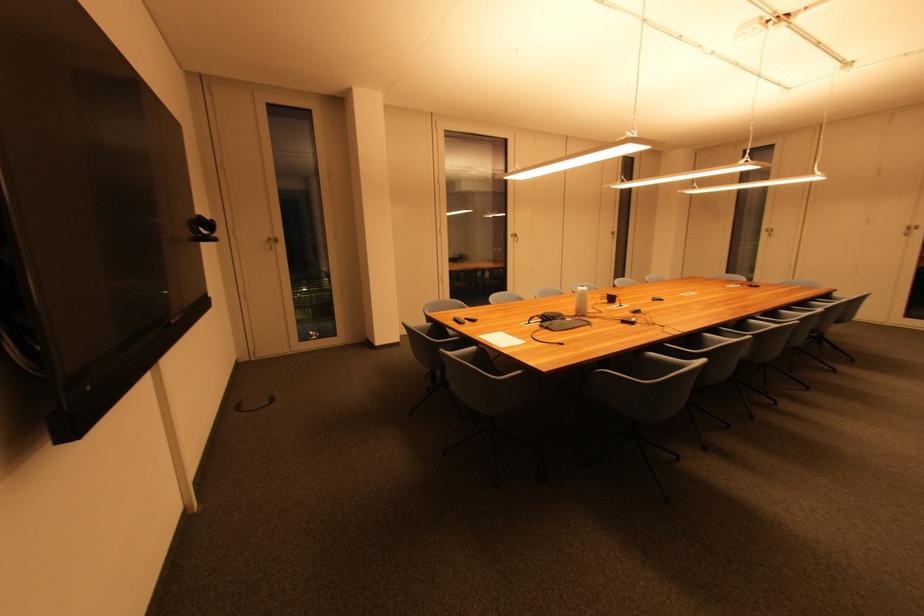
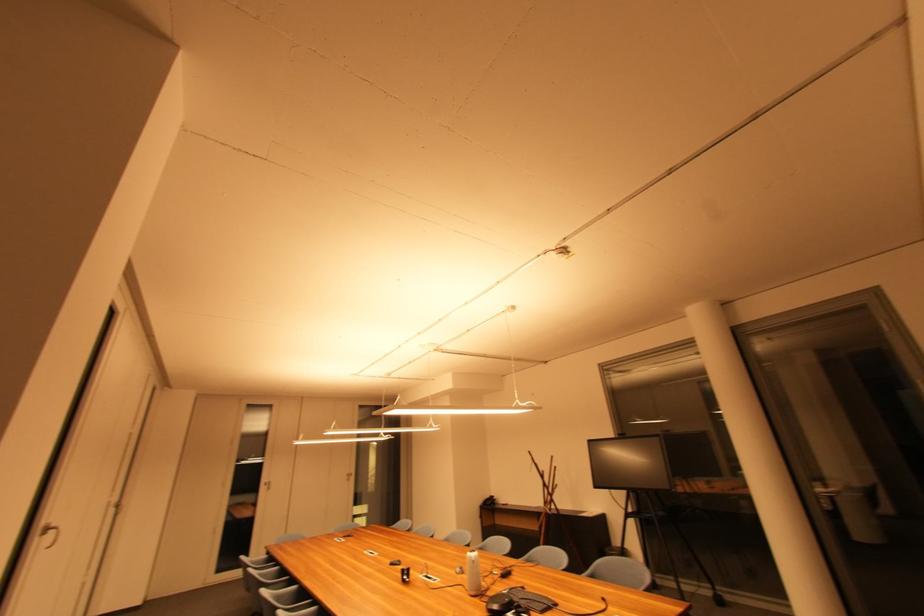
Where in the second image is the point corresponding to (x=772, y=232) from the first image?

(271, 485)